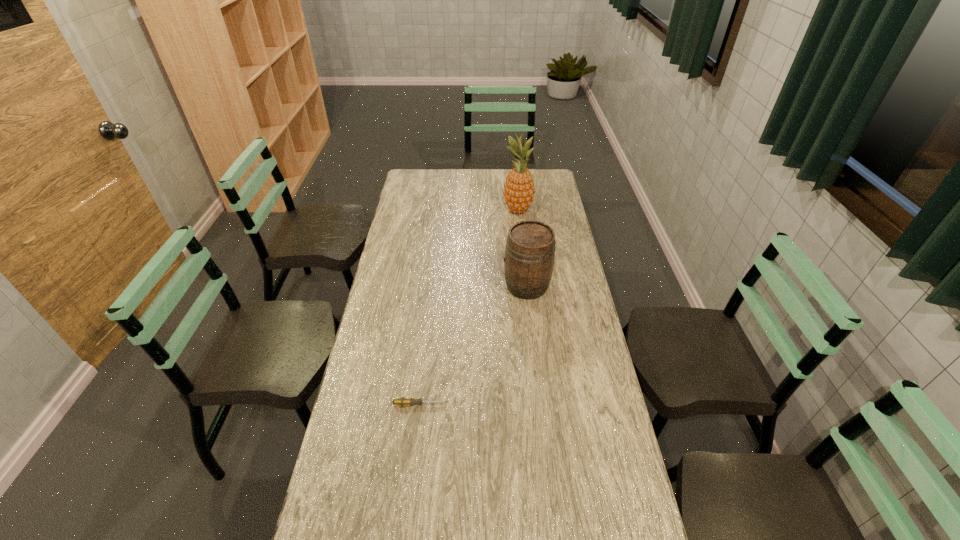
Where is `the tallest object`? the tallest object is located at coordinates (519, 190).

Find the location of a particular element. The width and height of the screenshot is (960, 540). the farthest object is located at coordinates (519, 190).

Identify the location of the second shortest object. This screenshot has width=960, height=540. (530, 250).

The height and width of the screenshot is (540, 960). In order to click on cider in this screenshot , I will do `click(530, 250)`.

Identify the location of the nearest object. (402, 401).

Find the location of a particular element. the shortest object is located at coordinates (402, 401).

Find the location of `vacant space located on the left of the tallest object`. vacant space located on the left of the tallest object is located at coordinates (452, 210).

Where is `free space located on the side of the cider near the bung hole`? This screenshot has height=540, width=960. free space located on the side of the cider near the bung hole is located at coordinates (483, 286).

The image size is (960, 540). I want to click on vacant space positioned 0.390m on the side of the cider near the bung hole, so pos(404,286).

In order to click on free space located on the side of the cider near the bung hole in this screenshot , I will do `click(402, 286)`.